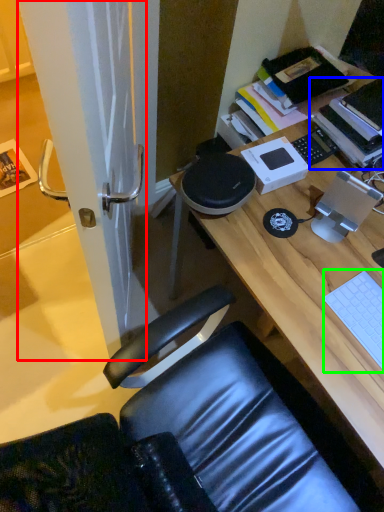
Question: Which object is positioned closest to screen door (highlighted by a red box)? Select from book (highlighted by a blue box) and laptop keyboard (highlighted by a green box).

Choices:
 (A) book
 (B) laptop keyboard

Answer: (B)